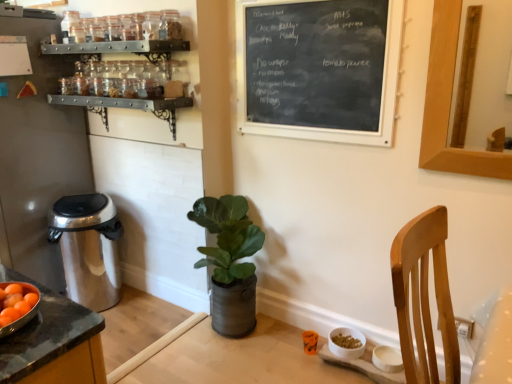
At what (x,y) coordinates should I click in order to perform the action: click on vacant area located to the right-hand side of green leafy plant in metallic pot at center. Please return your answer as a coordinate pair (x, y). The width and height of the screenshot is (512, 384). Looking at the image, I should click on (287, 342).